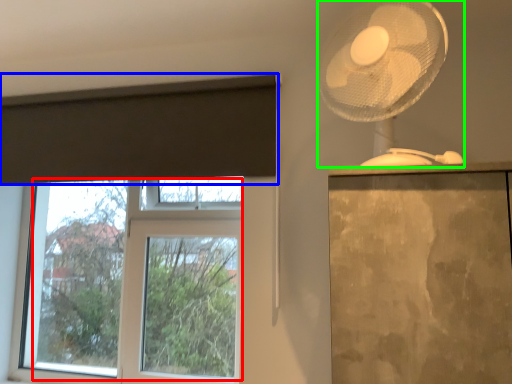
Question: Based on their relative distances, which object is nearer to bay window (highlighted by a red box)? Choose from curtain (highlighted by a blue box) and mechanical fan (highlighted by a green box).

Choices:
 (A) curtain
 (B) mechanical fan

Answer: (A)